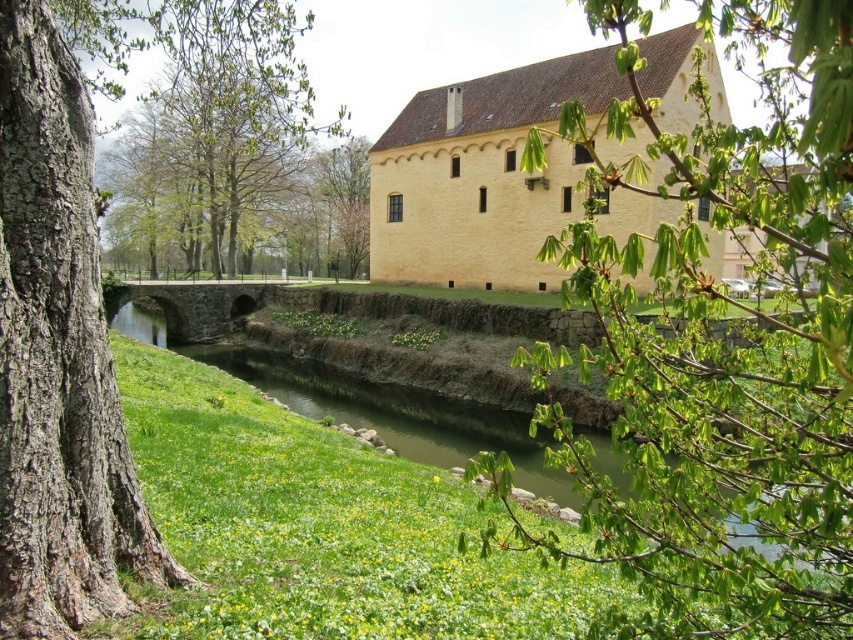
Is smooth bark tree at left smaller than green leafy tree at center?

Yes.

From the picture: Can you confirm if smooth bark tree at left is wider than green leafy tree at center?

Incorrect, smooth bark tree at left's width does not surpass green leafy tree at center's.

Where is `smooth bark tree at left`? Image resolution: width=853 pixels, height=640 pixels. smooth bark tree at left is located at coordinates (62, 332).

What do you see at coordinates (727, 344) in the screenshot? I see `green leafy branch at upper right` at bounding box center [727, 344].

Which of these two, green leafy branch at upper right or green leafy tree at upper center, stands shorter?

With less height is green leafy branch at upper right.

Who is more forward, (695, 188) or (357, 145)?

Positioned in front is point (695, 188).

The image size is (853, 640). In order to click on green leafy branch at upper right in this screenshot , I will do `click(727, 344)`.

Is point (38, 42) less distant than point (339, 243)?

Yes, point (38, 42) is closer to viewer.

Which of these two, smooth bark tree at left or green leafy tree at upper center, stands shorter?

Standing shorter between the two is green leafy tree at upper center.

Image resolution: width=853 pixels, height=640 pixels. I want to click on smooth bark tree at left, so click(x=62, y=332).

The width and height of the screenshot is (853, 640). I want to click on smooth bark tree at left, so [62, 332].